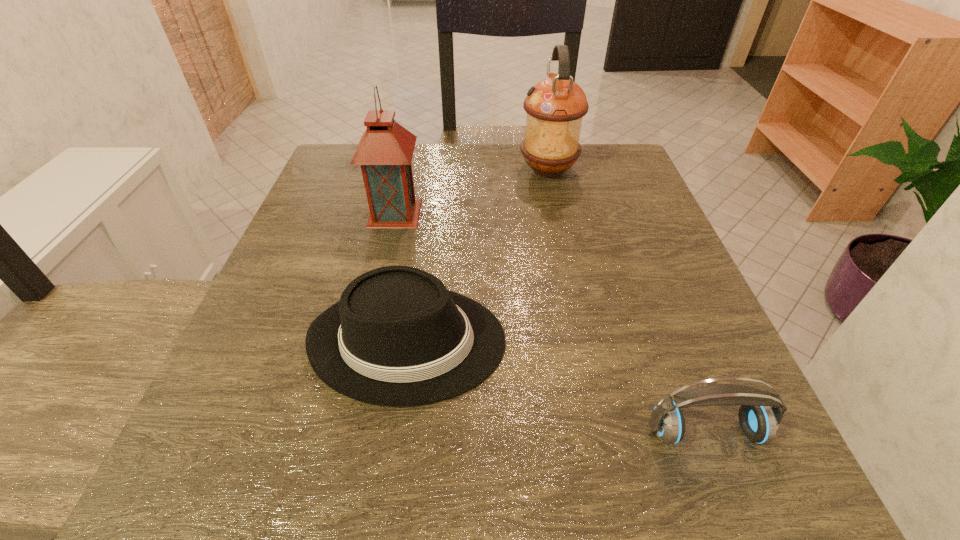
Find the location of a particular element. This screenshot has height=540, width=960. oil lamp is located at coordinates 555,106.

You are a GUI agent. You are given a task and a screenshot of the screen. Output one action in this format:
    pyautogui.click(x=<x>, y=<y>)
    Task: Click on the lantern
    This screenshot has width=960, height=540.
    Given the screenshot: What is the action you would take?
    pyautogui.click(x=385, y=151)

Find the location of a particular element. Image resolution: width=960 pixels, height=540 pixels. fedora is located at coordinates (397, 337).

Find the location of a particular element. Image resolution: width=960 pixels, height=540 pixels. the nearest object is located at coordinates [x=759, y=422].

This screenshot has height=540, width=960. Identify the location of free region located on the front of the oil lamp. (572, 284).

The width and height of the screenshot is (960, 540). I want to click on free space located 0.240m on the back of the lantern, so click(411, 147).

The width and height of the screenshot is (960, 540). I want to click on vacant space situated 0.270m on the front-facing side of the second nearest object, so click(676, 341).

Find the location of a particular element. This screenshot has height=540, width=960. object located at the far edge is located at coordinates (555, 106).

Image resolution: width=960 pixels, height=540 pixels. Find the location of `object present at the near edge`. object present at the near edge is located at coordinates (759, 422).

Find the location of a particular element. lantern located at the left edge is located at coordinates (385, 151).